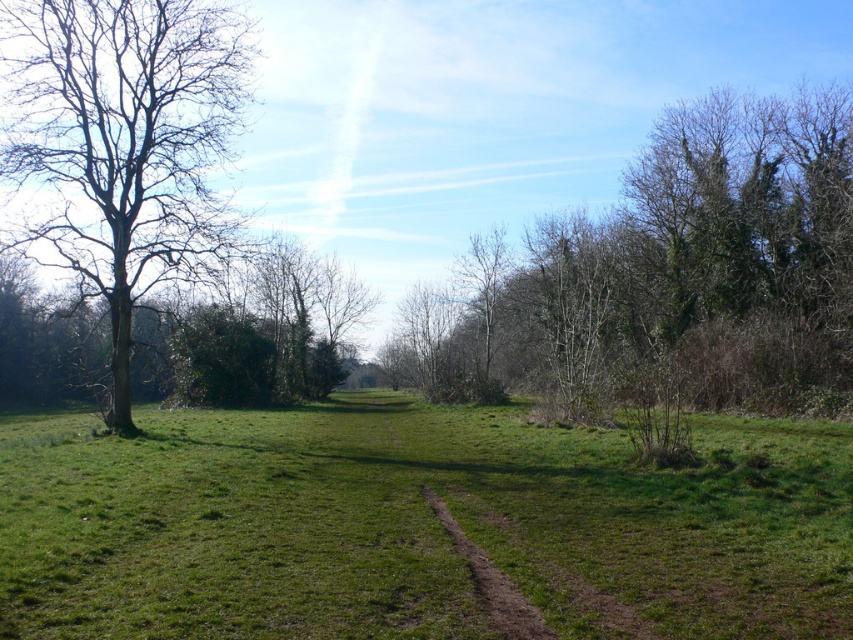
You are standing at the starting point of the dirt path in the grassy field. You see two points marked in the scene, point 1 at coordinates point (827,467) and point 2 at coordinates point (732,406). Which point is closer to you?

Point (827,467) is closer to the viewer than point (732,406).

You are planning to hang a bird feeder from one of the trees in the image. Which tree, the bare branches at upper right or the bare wood tree at left, would be more suitable for hanging a bird feeder?

The bare wood tree at left is more suitable for hanging a bird feeder because it is larger than the bare branches at upper right.